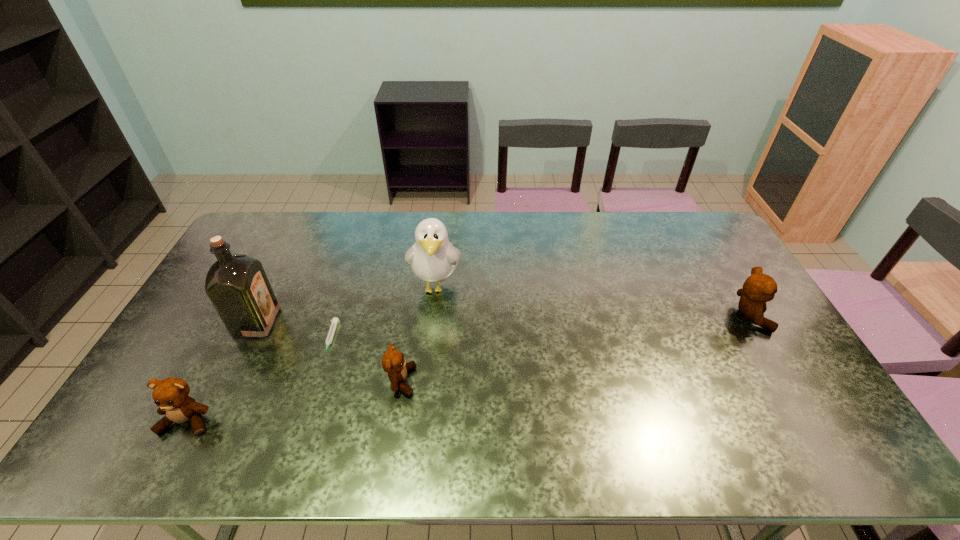
You are a GUI agent. You are given a task and a screenshot of the screen. Output one action in this format:
    pyautogui.click(x=<x>, y=<y>)
    Task: Click on the blank region between the fourth tallest object and the rightmost teddy bear
    The height and width of the screenshot is (540, 960).
    Given the screenshot: What is the action you would take?
    pos(468,368)

Locate an element on the screen. vacant area that lies between the fifth tallest object and the gull is located at coordinates (419, 334).

At what (x,y) coordinates should I click in order to perform the action: click on free spot between the fourth object from right to left and the rightmost object. Please return your answer as a coordinate pair (x, y). The image size is (960, 540). Looking at the image, I should click on (540, 328).

This screenshot has width=960, height=540. I want to click on object that is the fifth closest to the fourth object from right to left, so click(x=759, y=288).

Select which object is the closest to the liquor. Please provide its 2D coordinates. Your answer should be formatted as a tuple, i.e. [(x, y)], where the tuple contains the x and y coordinates of a point satisfying the conditions above.

[(335, 321)]

The width and height of the screenshot is (960, 540). I want to click on the second closest teddy bear relative to the third object from left to right, so click(171, 396).

I want to click on teddy bear that is the second closest to the fifth shortest object, so click(x=171, y=396).

I want to click on vacant area in the image that satisfies the following two spatial constraints: 1. on the front-facing side of the rightmost teddy bear; 2. at the needle end of the third object from left to right, so click(762, 339).

This screenshot has height=540, width=960. Find the location of `vacant space that satisfies the following two spatial constraints: 1. on the front-facing side of the rightmost teddy bear; 2. at the needle end of the fourth object from right to left`. vacant space that satisfies the following two spatial constraints: 1. on the front-facing side of the rightmost teddy bear; 2. at the needle end of the fourth object from right to left is located at coordinates (762, 339).

Find the location of a particular element. vacant area that satisfies the following two spatial constraints: 1. on the front-facing side of the farthest teddy bear; 2. at the needle end of the shortest object is located at coordinates (762, 339).